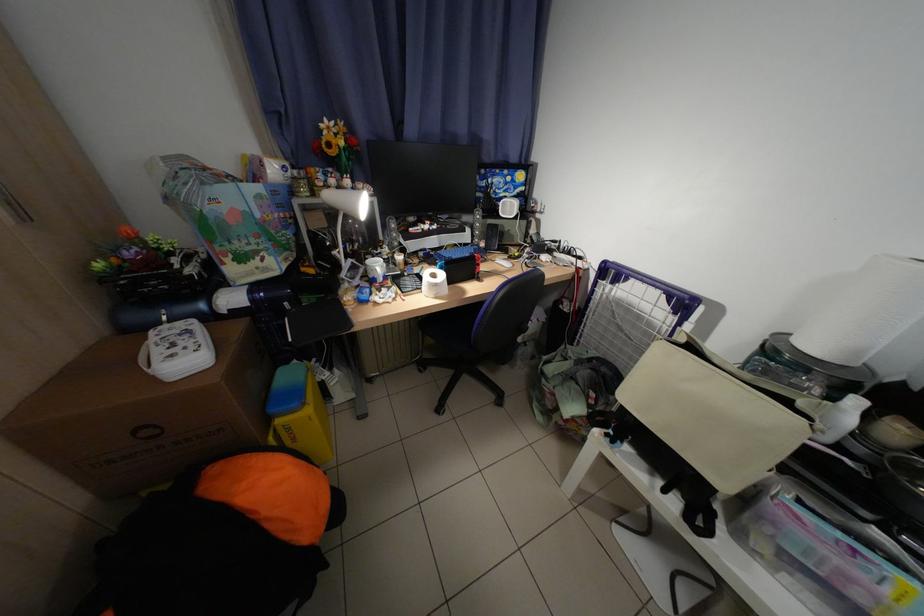
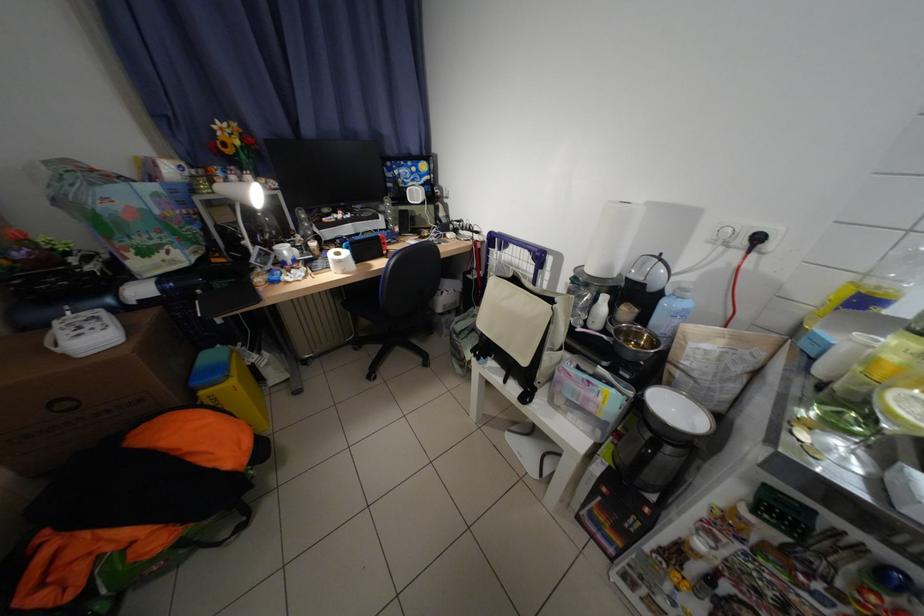
Question: The first image is from the beginning of the video and the second image is from the end. How did the camera likely rotate when shooting the video?

Choices:
 (A) Left
 (B) Right
 (C) Up
 (D) Down

Answer: (B)